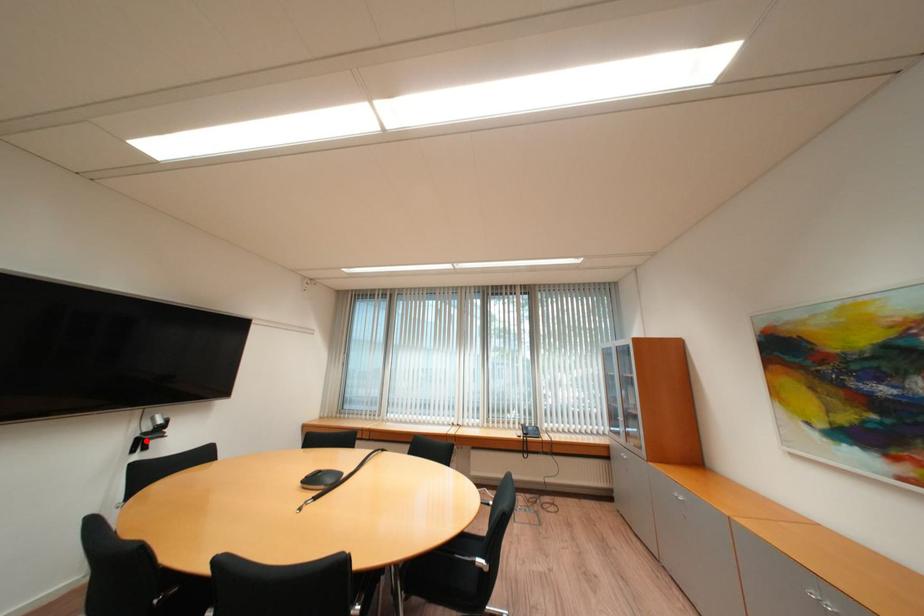
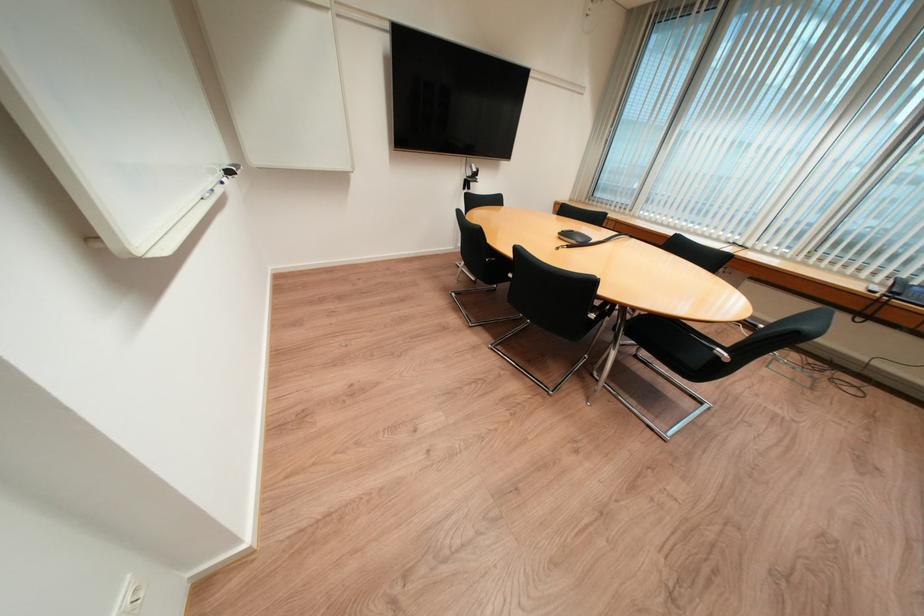
The point at the highlighted location is marked in the first image. Where is the corresponding point in the second image?

(473, 182)